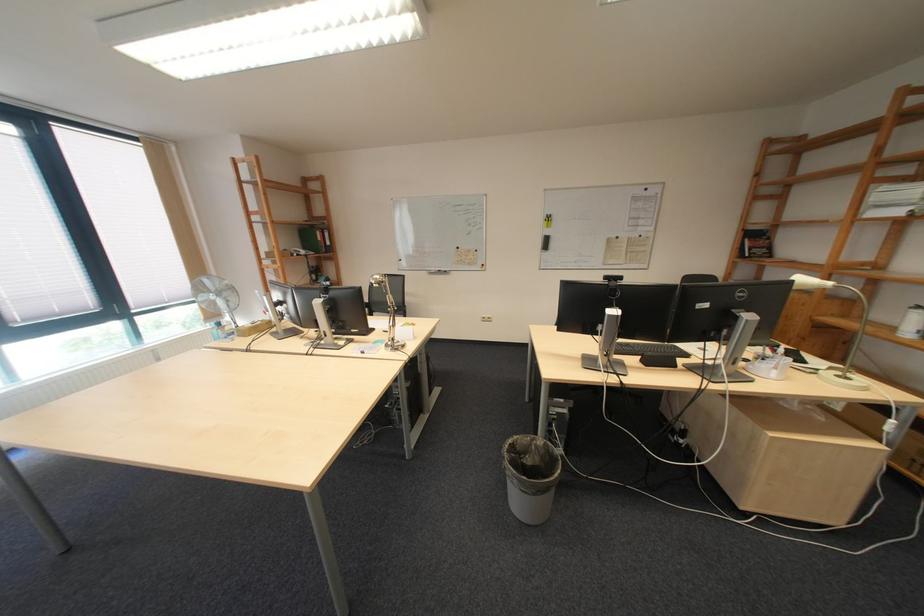
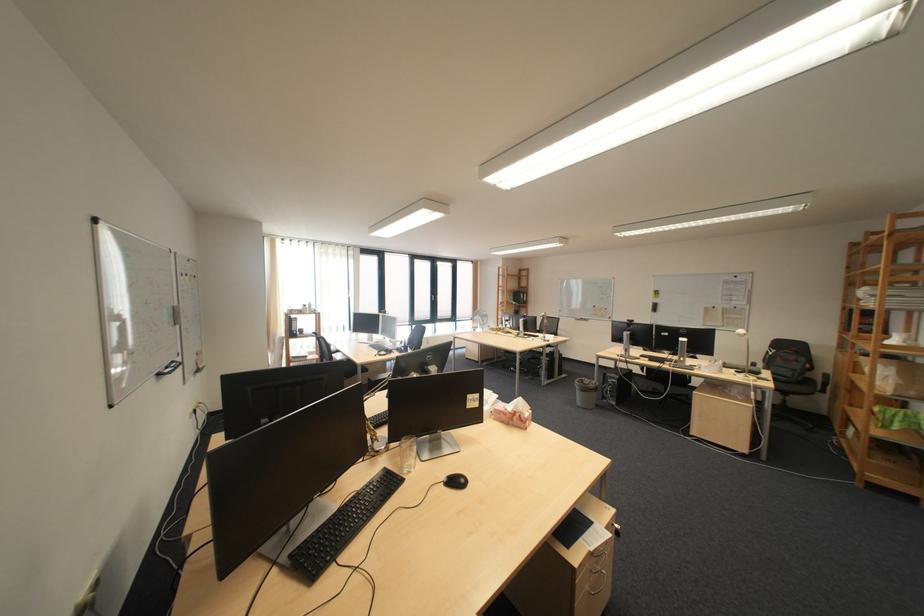
Where in the second image is the point corresponding to [472,249] from the first image?

(609, 308)